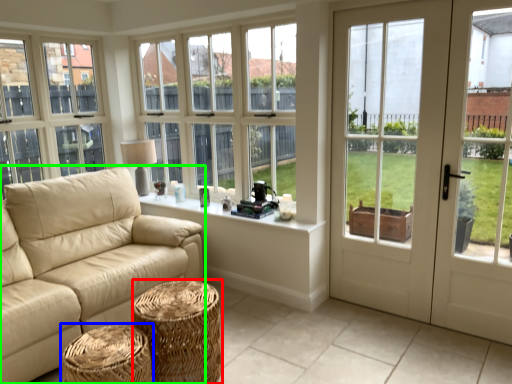
Question: Which object is the farthest from stool (highlighted by a red box)? Choose among these: stool (highlighted by a blue box) or studio couch (highlighted by a green box).

Choices:
 (A) stool
 (B) studio couch

Answer: (B)